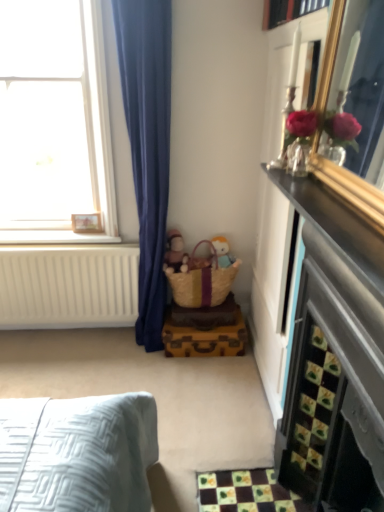
Question: Can you confirm if wooden picture frame at upper left is bigger than clear glass window at upper left?

Choices:
 (A) no
 (B) yes

Answer: (A)

Question: Is wooden picture frame at upper left next to clear glass window at upper left and touching it?

Choices:
 (A) no
 (B) yes

Answer: (A)

Question: Is wooden picture frame at upper left positioned far away from clear glass window at upper left?

Choices:
 (A) no
 (B) yes

Answer: (A)

Question: Does wooden picture frame at upper left have a greater width compared to clear glass window at upper left?

Choices:
 (A) yes
 (B) no

Answer: (B)

Question: Does wooden picture frame at upper left have a lesser width compared to clear glass window at upper left?

Choices:
 (A) no
 (B) yes

Answer: (B)

Question: Is wooden picture frame at upper left positioned behind clear glass window at upper left?

Choices:
 (A) yes
 (B) no

Answer: (A)

Question: Is matte brown doll at center facing towards white painted wood at left?

Choices:
 (A) no
 (B) yes

Answer: (A)

Question: From the image's perspective, is matte brown doll at center below white painted wood at left?

Choices:
 (A) no
 (B) yes

Answer: (B)

Question: Is matte brown doll at center outside white painted wood at left?

Choices:
 (A) no
 (B) yes

Answer: (B)

Question: Does matte brown doll at center contain white painted wood at left?

Choices:
 (A) no
 (B) yes

Answer: (A)

Question: From a real-world perspective, is matte brown doll at center beneath white painted wood at left?

Choices:
 (A) no
 (B) yes

Answer: (B)

Question: Is matte brown doll at center taller than white painted wood at left?

Choices:
 (A) yes
 (B) no

Answer: (A)

Question: Would you consider yellow woven basket at center to be distant from soft plush toy at center?

Choices:
 (A) no
 (B) yes

Answer: (A)